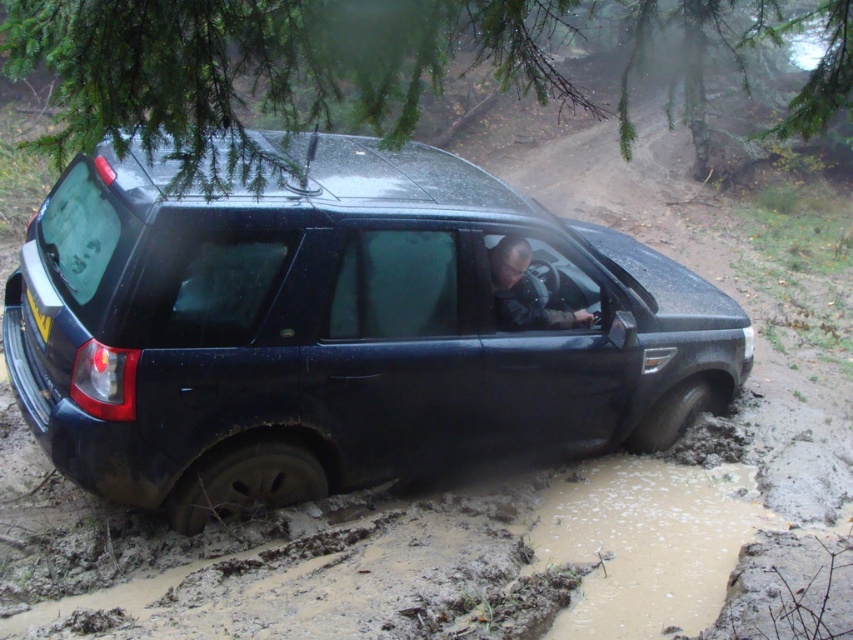
You are a drone operator trying to capture the best aerial shot of the two points marked in the scene. Which point, point (57,237) or point (560,310), would appear larger in your camera frame due to its proximity to the camera?

Point (57,237) is closer to the camera than point (560,310), so it would appear larger in the camera frame.

You are a driver trying to free the glossy black suv at center from the brown muddy puddle at lower center. Based on their sizes, which object would require more space to maneuver around?

The glossy black suv at center has a larger size compared to the brown muddy puddle at lower center, so it would require more space to maneuver around.